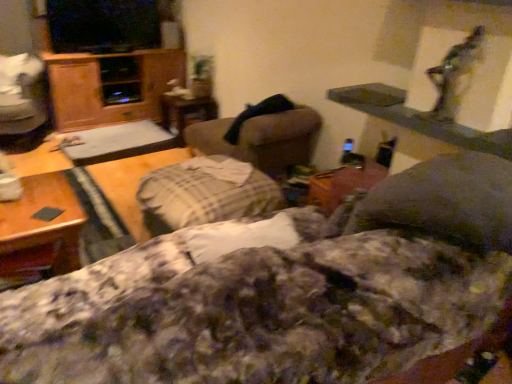
What is the approximate width of fluffy cotton blanket at center?

fluffy cotton blanket at center is 3.60 feet in width.

What is the approximate height of wooden table at center, acting as the fourth table starting from the right?

The height of wooden table at center, acting as the fourth table starting from the right, is 21.17 centimeters.

What do you see at coordinates (417, 118) in the screenshot?
I see `wooden table at upper right, which is the 1th table from right to left` at bounding box center [417, 118].

Locate an element on the screen. Image resolution: width=512 pixels, height=384 pixels. wooden table at upper right, which is the fourth table from back to front is located at coordinates (x=417, y=118).

What is the approximate width of wooden table at center, which ranks as the 3th table in left-to-right order?

The width of wooden table at center, which ranks as the 3th table in left-to-right order, is 16.57 inches.

Where is `wooden cabinet at left`? wooden cabinet at left is located at coordinates (111, 86).

How distant is brown wooden table at lower left, positioned as the 2th table in front-to-back order, from wooden cabinet at left?

brown wooden table at lower left, positioned as the 2th table in front-to-back order, and wooden cabinet at left are 2.04 meters apart from each other.

Looking at this image, is brown wooden table at lower left, placed as the second table when sorted from left to right, not near wooden cabinet at left?

Yes.

Looking at this image, which of these two, brown wooden table at lower left, which ranks as the 3th table in back-to-front order, or wooden cabinet at left, is thinner?

Thinner between the two is brown wooden table at lower left, which ranks as the 3th table in back-to-front order.

From a real-world perspective, between wooden table at center, which is the fourth table from front to back, and wooden swivel chair at left, the second swivel chair from the front, who is vertically lower?

wooden table at center, which is the fourth table from front to back, from a real-world perspective.

Does wooden table at center, which is counted as the first table, starting from the back, have a lesser height compared to wooden swivel chair at left, arranged as the 1th swivel chair when viewed from the back?

Correct, wooden table at center, which is counted as the first table, starting from the back, is not as tall as wooden swivel chair at left, arranged as the 1th swivel chair when viewed from the back.

From the image's perspective, is wooden table at center, which ranks as the 3th table in left-to-right order, positioned above or below wooden swivel chair at left, acting as the second swivel chair starting from the right?

wooden table at center, which ranks as the 3th table in left-to-right order, is situated lower than wooden swivel chair at left, acting as the second swivel chair starting from the right, in the image.

In the image, is wooden table at center, which is the fourth table from front to back, positioned in front of or behind wooden swivel chair at left, the second swivel chair from the front?

In the image, wooden table at center, which is the fourth table from front to back, appears behind wooden swivel chair at left, the second swivel chair from the front.

In the scene shown: Is brown wooden table at lower left, positioned as the 2th table in front-to-back order, looking in the opposite direction of wooden swivel chair at left, the second swivel chair from the front?

brown wooden table at lower left, positioned as the 2th table in front-to-back order, is not turned away from wooden swivel chair at left, the second swivel chair from the front.

In terms of size, does brown wooden table at lower left, positioned as the 2th table in front-to-back order, appear bigger or smaller than wooden swivel chair at left, arranged as the 1th swivel chair when viewed from the back?

Considering their sizes, brown wooden table at lower left, positioned as the 2th table in front-to-back order, takes up less space than wooden swivel chair at left, arranged as the 1th swivel chair when viewed from the back.

From a real-world perspective, relative to wooden swivel chair at left, the second swivel chair from the front, is brown wooden table at lower left, placed as the second table when sorted from left to right, vertically above or below?

Clearly, from a real-world perspective, brown wooden table at lower left, placed as the second table when sorted from left to right, is below wooden swivel chair at left, the second swivel chair from the front.

Is brown wooden table at lower left, placed as the second table when sorted from left to right, directly adjacent to wooden swivel chair at left, acting as the second swivel chair starting from the right?

No, brown wooden table at lower left, placed as the second table when sorted from left to right, is not next to wooden swivel chair at left, acting as the second swivel chair starting from the right.

What's the angular difference between wooden swivel chair at left, arranged as the 1th swivel chair when viewed from the back, and brown wooden table at lower left, placed as the second table when sorted from left to right,'s facing directions?

148 degrees.

Is wooden swivel chair at left, arranged as the 1th swivel chair when viewed from the back, aimed at brown wooden table at lower left, placed as the second table when sorted from left to right?

No, wooden swivel chair at left, arranged as the 1th swivel chair when viewed from the back, is not oriented towards brown wooden table at lower left, placed as the second table when sorted from left to right.

Which of these two, wooden swivel chair at left, acting as the second swivel chair starting from the right, or brown wooden table at lower left, which ranks as the 3th table in back-to-front order, is bigger?

wooden swivel chair at left, acting as the second swivel chair starting from the right, is bigger.

Looking at this image, from a real-world perspective, is wooden swivel chair at left, the second swivel chair from the front, positioned above or below brown wooden table at lower left, positioned as the 2th table in front-to-back order?

From a real-world perspective, wooden swivel chair at left, the second swivel chair from the front, is physically above brown wooden table at lower left, positioned as the 2th table in front-to-back order.

How different are the orientations of wooden table at center, arranged as the first table when viewed from the left, and wooden cabinet at left in degrees?

They differ by 91.9 degrees in their facing directions.

Is wooden table at center, which appears as the 3th table when viewed from the front, completely or partially outside of wooden cabinet at left?

Yes, wooden table at center, which appears as the 3th table when viewed from the front, is outside of wooden cabinet at left.

From a real-world perspective, who is located higher, wooden table at center, acting as the fourth table starting from the right, or wooden cabinet at left?

wooden cabinet at left.

Does wooden table at center, positioned as the second table in back-to-front order, have a lesser width compared to wooden cabinet at left?

Indeed, wooden table at center, positioned as the second table in back-to-front order, has a lesser width compared to wooden cabinet at left.

Which of these two, wooden table at center, acting as the fourth table starting from the right, or wooden table at center, which is the fourth table from front to back, is thinner?

wooden table at center, which is the fourth table from front to back.

Can you see wooden table at center, positioned as the second table in back-to-front order, touching wooden table at center, the 2th table viewed from the right?

No, wooden table at center, positioned as the second table in back-to-front order, is not in contact with wooden table at center, the 2th table viewed from the right.

Is wooden table at center, which appears as the 3th table when viewed from the front, facing towards wooden table at center, the 2th table viewed from the right?

No, wooden table at center, which appears as the 3th table when viewed from the front, is not oriented towards wooden table at center, the 2th table viewed from the right.

Can you tell me how much brown wooden table at lower left, positioned as the 2th table in front-to-back order, and wooden table at upper right, which is the fourth table from left to right, differ in facing direction?

93 degrees separate the facing orientations of brown wooden table at lower left, positioned as the 2th table in front-to-back order, and wooden table at upper right, which is the fourth table from left to right.

Which object is closer to the camera, brown wooden table at lower left, which ranks as the 3th table in back-to-front order, or wooden table at upper right, acting as the 1th table starting from the front?

wooden table at upper right, acting as the 1th table starting from the front.

Is brown wooden table at lower left, positioned as the 2th table in front-to-back order, wider than wooden table at upper right, which is the fourth table from back to front?

Correct, the width of brown wooden table at lower left, positioned as the 2th table in front-to-back order, exceeds that of wooden table at upper right, which is the fourth table from back to front.

Based on their sizes in the image, would you say brown wooden table at lower left, the 3th table when ordered from right to left, is bigger or smaller than wooden table at upper right, which is the 1th table from right to left?

brown wooden table at lower left, the 3th table when ordered from right to left, is bigger than wooden table at upper right, which is the 1th table from right to left.

The width and height of the screenshot is (512, 384). Find the location of `table that is the 4th one when counting downward from the wooden cabinet at left (from the image's perspective)`. table that is the 4th one when counting downward from the wooden cabinet at left (from the image's perspective) is located at coordinates (44, 220).

Where is `table that is the 3rd object to the right of the wooden swivel chair at left, the 1th swivel chair when ordered from left to right, starting at the anchor`? The image size is (512, 384). table that is the 3rd object to the right of the wooden swivel chair at left, the 1th swivel chair when ordered from left to right, starting at the anchor is located at coordinates (186, 112).

From the image, which object appears to be nearer to fluffy cotton blanket at center, wooden cabinet at left or wooden table at upper right, which is the 1th table from right to left?

wooden table at upper right, which is the 1th table from right to left, is closer to fluffy cotton blanket at center.

Considering their positions, is wooden table at upper right, which is the fourth table from back to front, positioned closer to plush beige swivel chair at center, positioned as the first swivel chair in right-to-left order, than wooden swivel chair at left, the second swivel chair from the front?

The object closer to plush beige swivel chair at center, positioned as the first swivel chair in right-to-left order, is wooden table at upper right, which is the fourth table from back to front.

Based on their spatial positions, is plush beige swivel chair at center, the 2th swivel chair in the back-to-front sequence, or wooden cabinet at left further from wooden table at center, which is the fourth table from front to back?

plush beige swivel chair at center, the 2th swivel chair in the back-to-front sequence, is further to wooden table at center, which is the fourth table from front to back.

Looking at the image, which one is located further to wooden table at center, arranged as the first table when viewed from the left, brown wooden table at lower left, which ranks as the 3th table in back-to-front order, or wooden table at center, which ranks as the 3th table in left-to-right order?

brown wooden table at lower left, which ranks as the 3th table in back-to-front order, lies further to wooden table at center, arranged as the first table when viewed from the left, than the other object.

Based on the photo, based on their spatial positions, is wooden table at center, acting as the fourth table starting from the right, or wooden cabinet at left further from wooden swivel chair at left, the second swivel chair from the front?

wooden cabinet at left is positioned further to the anchor wooden swivel chair at left, the second swivel chair from the front.

When comparing their distances from wooden swivel chair at left, the 1th swivel chair when ordered from left to right, does plush beige swivel chair at center, acting as the first swivel chair starting from the front, or wooden table at upper right, which is the fourth table from left to right, seem closer?

plush beige swivel chair at center, acting as the first swivel chair starting from the front, is closer to wooden swivel chair at left, the 1th swivel chair when ordered from left to right.

When comparing their distances from wooden cabinet at left, does wooden table at center, positioned as the second table in back-to-front order, or wooden table at center, the 2th table viewed from the right, seem closer?

wooden table at center, the 2th table viewed from the right, is closer to wooden cabinet at left.

Based on their spatial positions, is wooden table at center, which is counted as the first table, starting from the back, or wooden table at upper right, which is the fourth table from left to right, closer to plush beige swivel chair at center, positioned as the first swivel chair in right-to-left order?

wooden table at upper right, which is the fourth table from left to right, lies closer to plush beige swivel chair at center, positioned as the first swivel chair in right-to-left order, than the other object.

Locate an element on the screen. dresser between brown wooden table at lower left, positioned as the 2th table in front-to-back order, and wooden table at center, the 2th table viewed from the right, from front to back is located at coordinates (111, 86).

The image size is (512, 384). In order to click on dresser between plush beige swivel chair at center, the second swivel chair positioned from the left, and wooden table at center, the 2th table viewed from the right, from front to back in this screenshot , I will do `click(111, 86)`.

Identify the location of bedding situated between wooden swivel chair at left, arranged as the 1th swivel chair when viewed from the back, and wooden table at upper right, which is the fourth table from left to right, from left to right. The width and height of the screenshot is (512, 384). (252, 308).

You are a GUI agent. You are given a task and a screenshot of the screen. Output one action in this format:
    pyautogui.click(x=<x>, y=<y>)
    Task: Click on the bedding located between brown wooden table at lower left, which ranks as the 3th table in back-to-front order, and wooden table at upper right, which is the fourth table from left to right, in the left-right direction
    The image size is (512, 384).
    Given the screenshot: What is the action you would take?
    pyautogui.click(x=252, y=308)